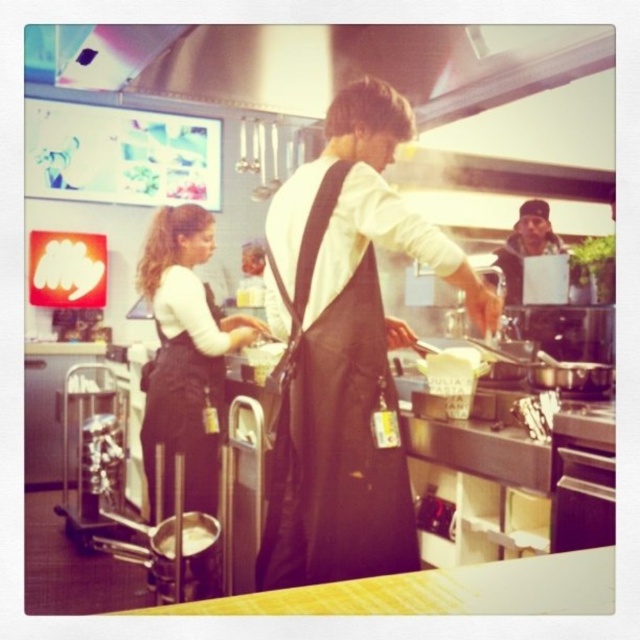
You are a new employee in the kitchen and need to place a yellow matte bowl at center on the counter. However, there is a black fabric apron at center in the way. Can you move the bowl to the center without removing the apron?

The black fabric apron at center is above the yellow matte bowl at center, so you can move the yellow matte bowl at center by sliding it out from under the apron.

Based on the photo, you are a chef in this kitchen and need to place the yellow matte bowl at center on top of the black fabric apron at center. Is this possible based on their sizes?

The black fabric apron at center is much taller than the yellow matte bowl at center, so it should be possible to place the yellow matte bowl at center on top of the black fabric apron at center since the apron is taller and can support the bowl.